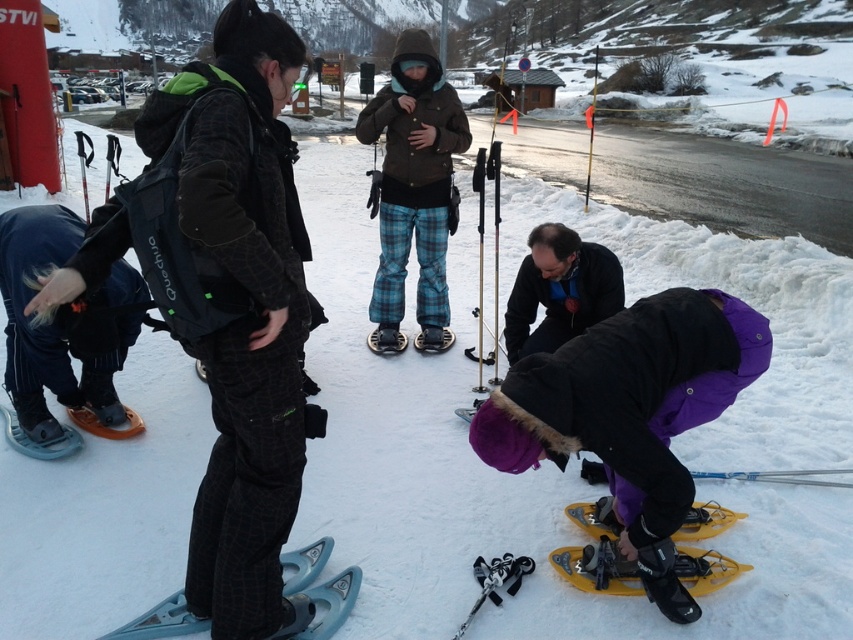
You are planning to carry both the metallic ski pole at center and the orange matte snowshoe at lower left in your backpack. Which object should you place first into your backpack to ensure proper packing?

You should place the metallic ski pole at center first because it is bigger than the orange matte snowshoe at lower left, allowing smaller items to be packed around it.